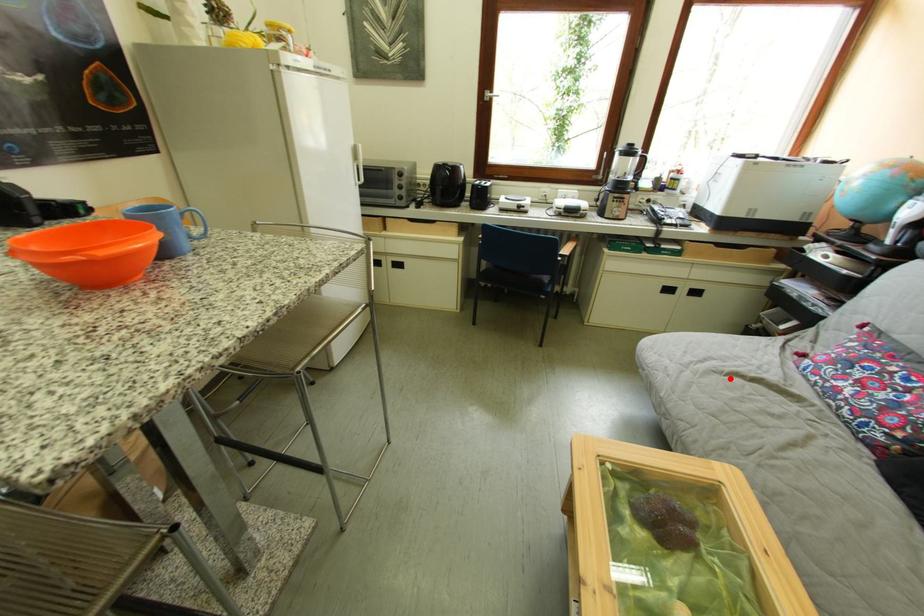
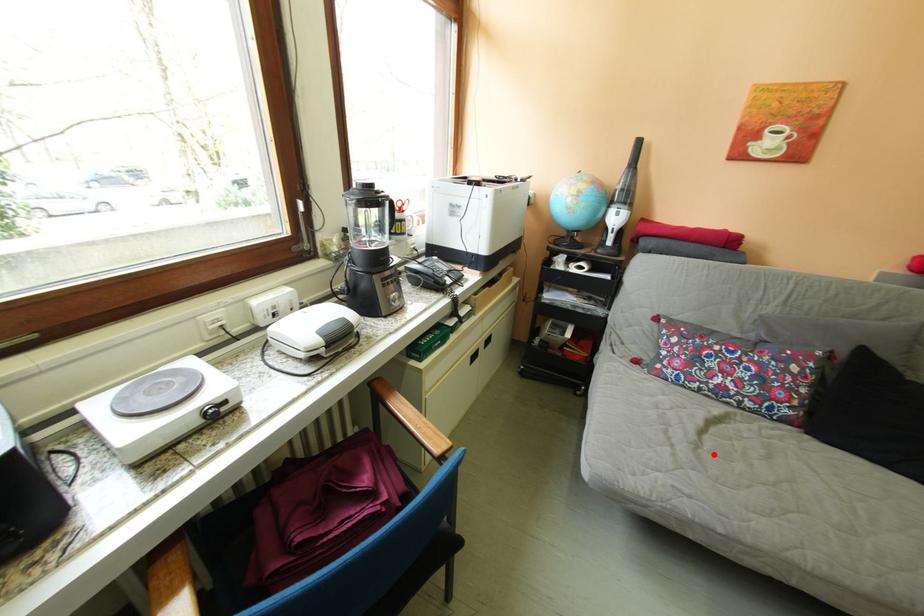
I am providing you with two images of the same scene from different viewpoints. A red point is marked on the first image and another point is marked on the second image. Is the marked point in image1 the same physical position as the marked point in image2?

Yes